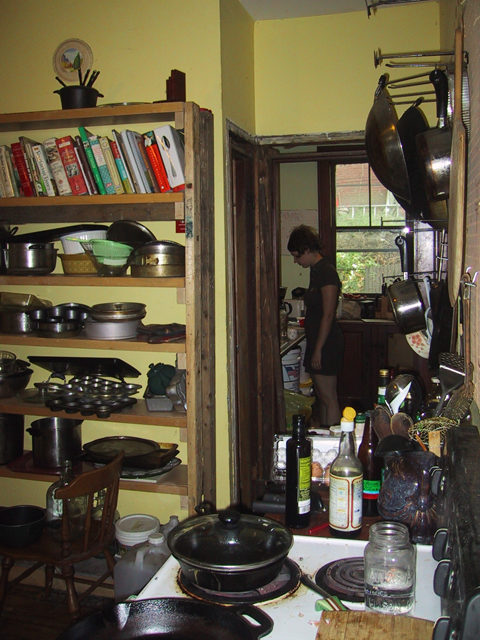
Identify the location of stove top. The image size is (480, 640). (281, 609).